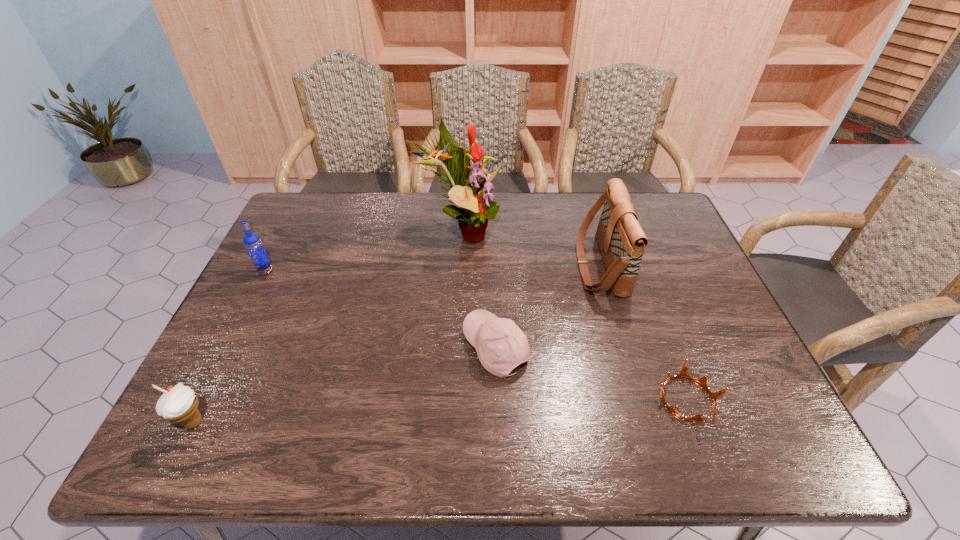
Locate an element on the screen. free space between the second tallest object and the tallest object is located at coordinates (531, 249).

Find the location of a particular element. The width and height of the screenshot is (960, 540). vacant space in between the second shortest object and the crown is located at coordinates (591, 374).

The height and width of the screenshot is (540, 960). I want to click on free space between the shortest object and the shoulder bag, so click(643, 333).

Where is `empty space that is in between the shoulder bag and the vodka`? This screenshot has width=960, height=540. empty space that is in between the shoulder bag and the vodka is located at coordinates (433, 269).

The image size is (960, 540). Identify the location of unoccupied position between the second tallest object and the second shortest object. (547, 307).

Identify the location of vacant area between the third tallest object and the shoulder bag. The width and height of the screenshot is (960, 540). click(x=433, y=269).

Locate an element on the screen. Image resolution: width=960 pixels, height=540 pixels. empty space between the third shortest object and the baseball cap is located at coordinates (345, 385).

Where is `vacant space that's between the shoulder bag and the icecream`? Image resolution: width=960 pixels, height=540 pixels. vacant space that's between the shoulder bag and the icecream is located at coordinates (396, 344).

Image resolution: width=960 pixels, height=540 pixels. I want to click on vacant space that's between the icecream and the baseball cap, so click(345, 385).

Find the location of `object that stands as the fifth closest to the vodka`. object that stands as the fifth closest to the vodka is located at coordinates (x=683, y=374).